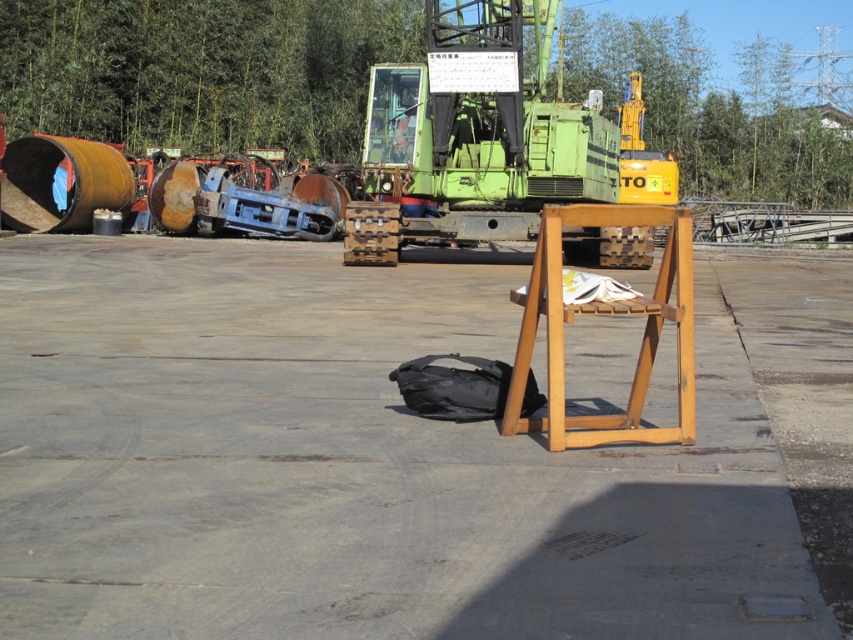
Consider the image. You are organizing a small outdoor event and need to place a table and a barrel. Based on the scene, where should you position the wooden table at center and the rusty metal barrel at left to match the existing setup?

To match the existing setup, position the wooden table at center to the right of the rusty metal barrel at left as it is already placed in that configuration.

You are a maintenance worker needing to place a tool on the wooden table at center. However, you notice the rusty metal barrel at left. Is the table located above or below the barrel?

The wooden table at center is below the rusty metal barrel at left, so the table is located below the barrel.

You are an equipment inspector needing to park your 1.2m wide vehicle between the green matte forklift at center and the rusty metal barrel at left. Can your vehicle fit in the space between them?

The green matte forklift at center is wider than the rusty metal barrel at left. Since the vehicle is 1.2m wide, it depends on the actual space between them. However, the description only states the forklift is wider, not the distance between them. Therefore, insufficient information to determine if the vehicle can fit.